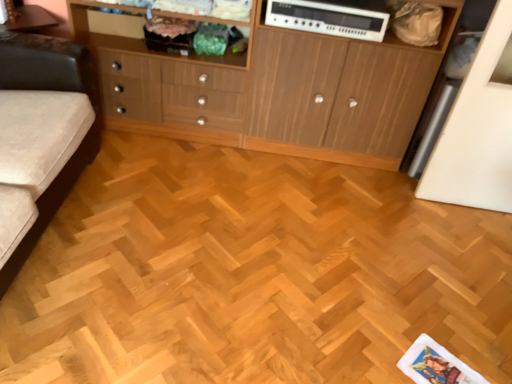
This screenshot has width=512, height=384. I want to click on blank space situated above light brown wood parquet floor at center (from a real-world perspective), so click(x=259, y=267).